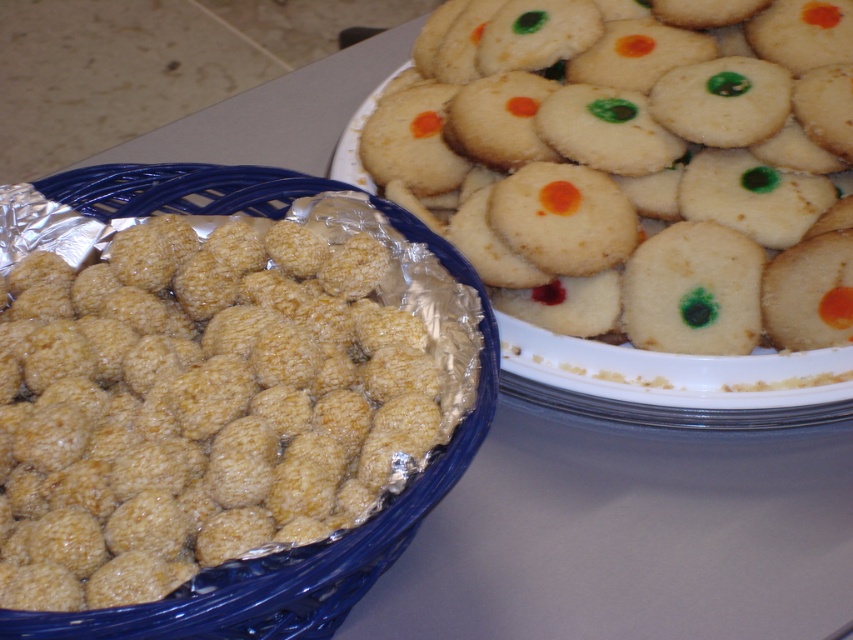
You are a baker who needs to place a 40 cm ruler between the golden textured balls at left and the matte white cookie at upper right. Can the ruler fit entirely between them without overlapping either object?

The golden textured balls at left is 38.28 centimeters from matte white cookie at upper right. Since the distance between them is less than the ruler length, the ruler cannot fit entirely between them without overlapping either object.

You are a customer at a bakery and see the blue wicker basket with golden textured balls at left and the white plate with light beige glossy cookies at right. The point marked at coordinates (x=196, y=404) is part of which item?

The point marked at coordinates (x=196, y=404) corresponds to the golden textured balls at left in the blue wicker basket.

You are a baker who wants to pack the golden textured balls at left and the matte white cookie at upper right into a box. The box can only hold items that are smaller than 10 cm in diameter. Which of the two items will fit inside the box?

The golden textured balls at left is smaller than matte white cookie at upper right. Since the box can only hold items smaller than 10 cm in diameter, the golden textured balls at left will fit inside the box, but the matte white cookie at upper right may be too large.